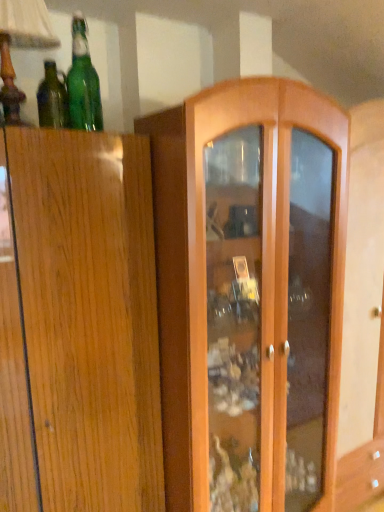
Question: Considering the relative sizes of green glass bottle at upper left, which appears as the 2th bottle when viewed from the left, and wooden table lamp at upper left in the image provided, is green glass bottle at upper left, which appears as the 2th bottle when viewed from the left, shorter than wooden table lamp at upper left?

Choices:
 (A) no
 (B) yes

Answer: (B)

Question: From the image's perspective, is green glass bottle at upper left, which appears as the 2th bottle when viewed from the left, below wooden table lamp at upper left?

Choices:
 (A) no
 (B) yes

Answer: (B)

Question: Is green glass bottle at upper left, placed as the first bottle when sorted from right to left, not near wooden table lamp at upper left?

Choices:
 (A) yes
 (B) no

Answer: (B)

Question: Is the depth of green glass bottle at upper left, which appears as the 2th bottle when viewed from the left, greater than that of wooden table lamp at upper left?

Choices:
 (A) yes
 (B) no

Answer: (A)

Question: From the image's perspective, is green glass bottle at upper left, placed as the first bottle when sorted from right to left, located above wooden table lamp at upper left?

Choices:
 (A) no
 (B) yes

Answer: (A)

Question: Does green glass bottle at upper left, placed as the first bottle when sorted from right to left, appear on the left side of wooden table lamp at upper left?

Choices:
 (A) yes
 (B) no

Answer: (B)

Question: Does wooden table lamp at upper left have a lesser width compared to green glass bottle at upper left, which appears as the 2th bottle when viewed from the left?

Choices:
 (A) no
 (B) yes

Answer: (A)

Question: Is wooden table lamp at upper left smaller than green glass bottle at upper left, which appears as the 2th bottle when viewed from the left?

Choices:
 (A) yes
 (B) no

Answer: (B)

Question: From a real-world perspective, is wooden table lamp at upper left located higher than green glass bottle at upper left, which appears as the 2th bottle when viewed from the left?

Choices:
 (A) no
 (B) yes

Answer: (B)

Question: Is the surface of wooden table lamp at upper left in direct contact with green glass bottle at upper left, which appears as the 2th bottle when viewed from the left?

Choices:
 (A) no
 (B) yes

Answer: (A)

Question: From the image's perspective, is wooden table lamp at upper left on top of green glass bottle at upper left, placed as the first bottle when sorted from right to left?

Choices:
 (A) no
 (B) yes

Answer: (B)

Question: Does wooden table lamp at upper left come behind green glass bottle at upper left, placed as the first bottle when sorted from right to left?

Choices:
 (A) yes
 (B) no

Answer: (B)

Question: Is green glass bottle at upper left, placed as the 2th bottle when sorted from right to left, positioned in front of wooden table lamp at upper left?

Choices:
 (A) yes
 (B) no

Answer: (B)